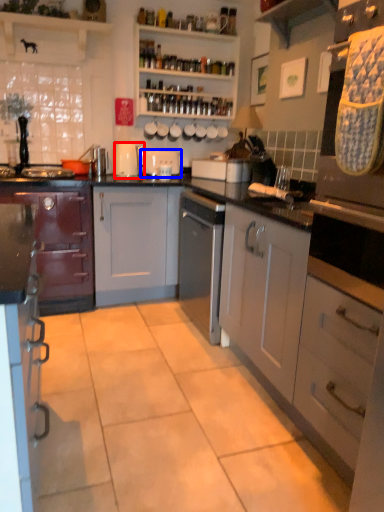
Question: Which point is closer to the camera, kitchen appliance (highlighted by a red box) or appliance (highlighted by a blue box)?

Choices:
 (A) kitchen appliance
 (B) appliance

Answer: (A)